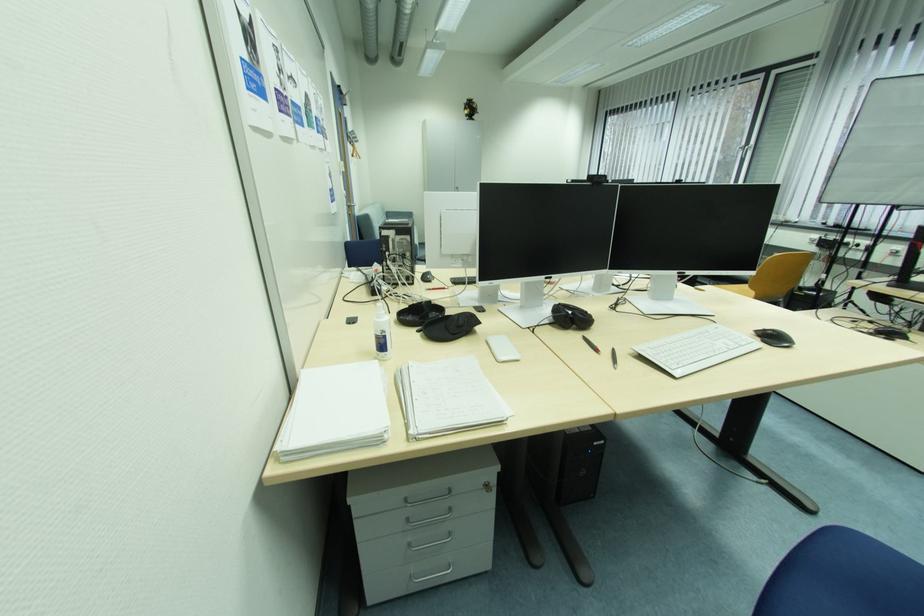
At what (x,y) coordinates should I click in order to perform the action: click on blue chair sitting surface. Please return your answer as a coordinate pair (x, y). The height and width of the screenshot is (616, 924). Looking at the image, I should click on (843, 578).